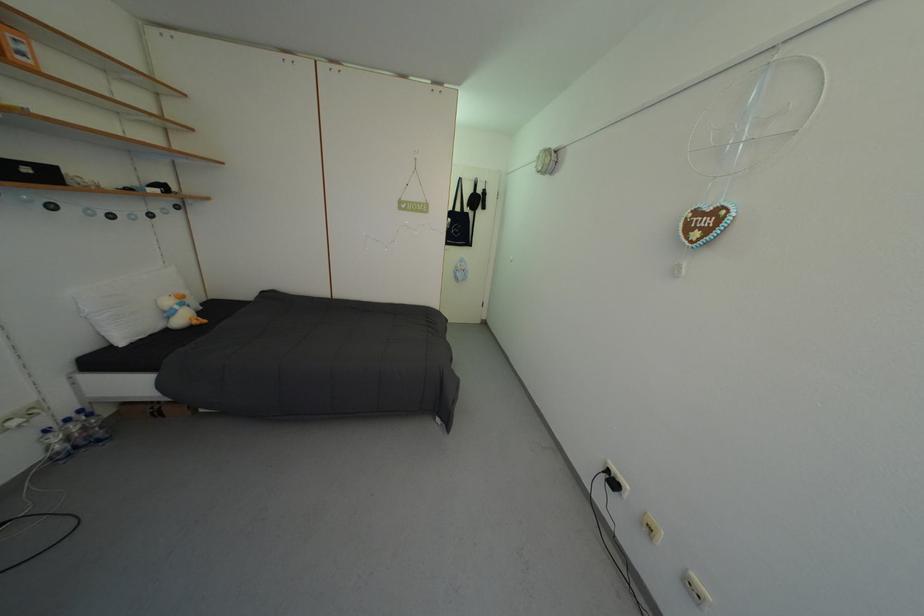
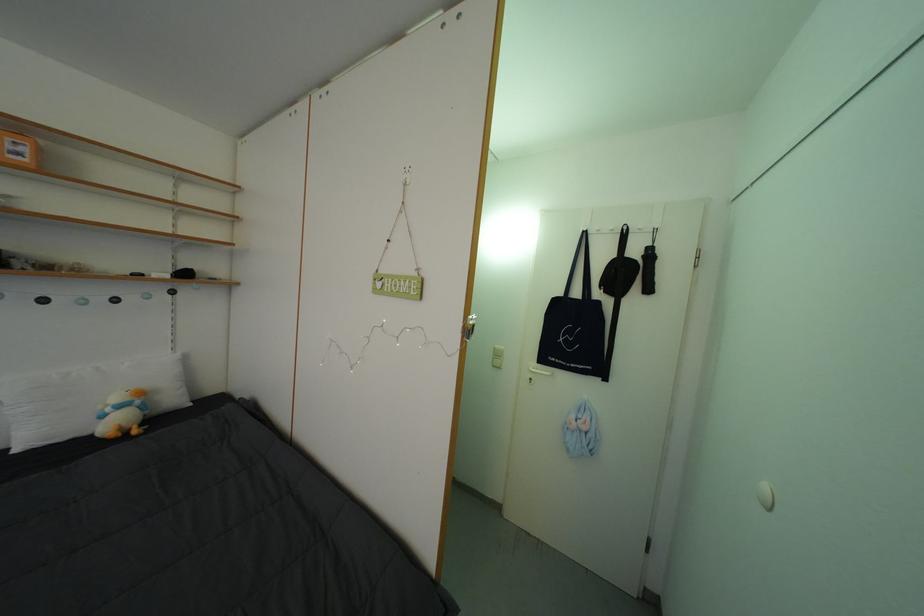
Find the pixel in the second image that matches point 30,60 in the first image.

(27, 160)